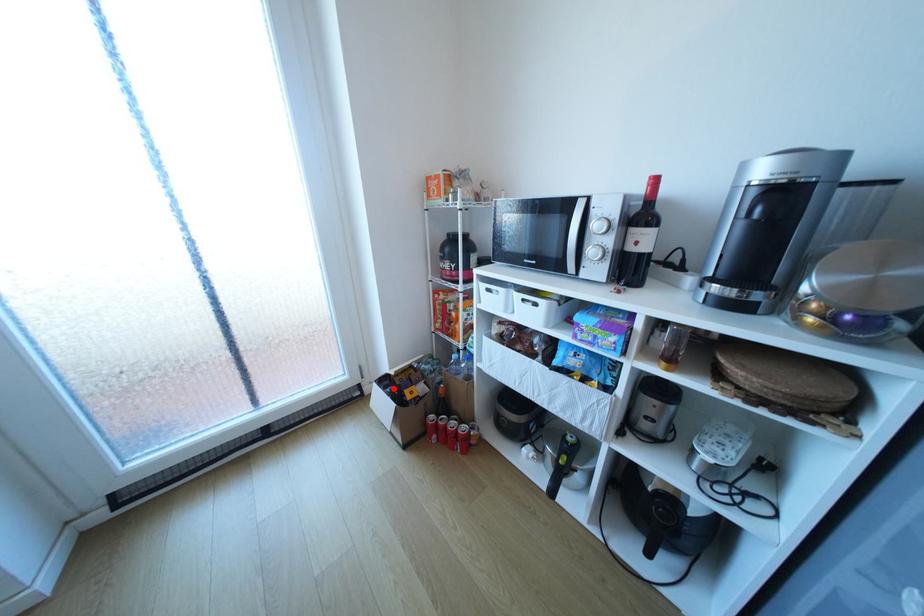
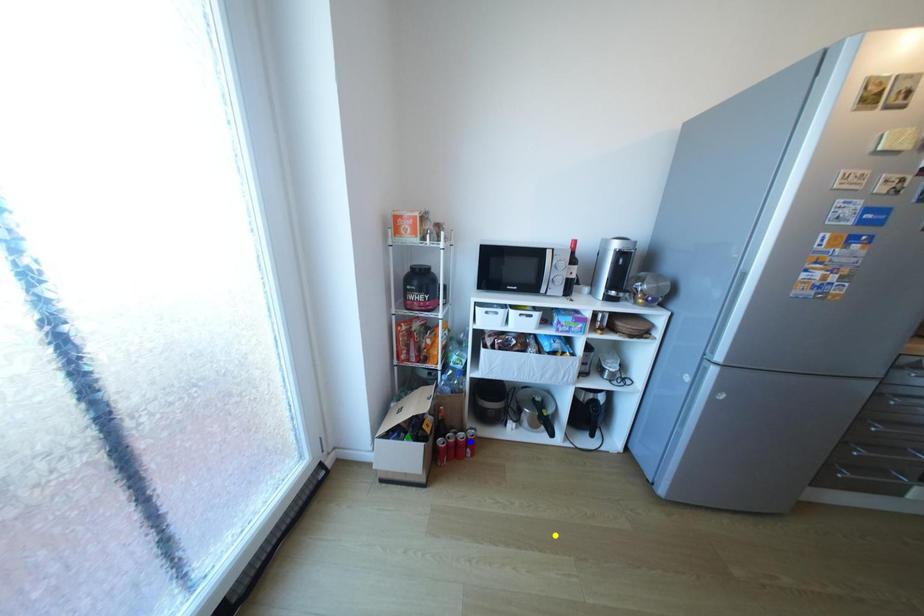
Question: I am providing you with two images of the same scene from different viewpoints. A red point is marked on the first image. You are given multiple points on the second image. In image 2, which mark is for the same physical point as the one in image 1?

Choices:
 (A) yellow point
 (B) green point
 (C) blue point

Answer: (B)